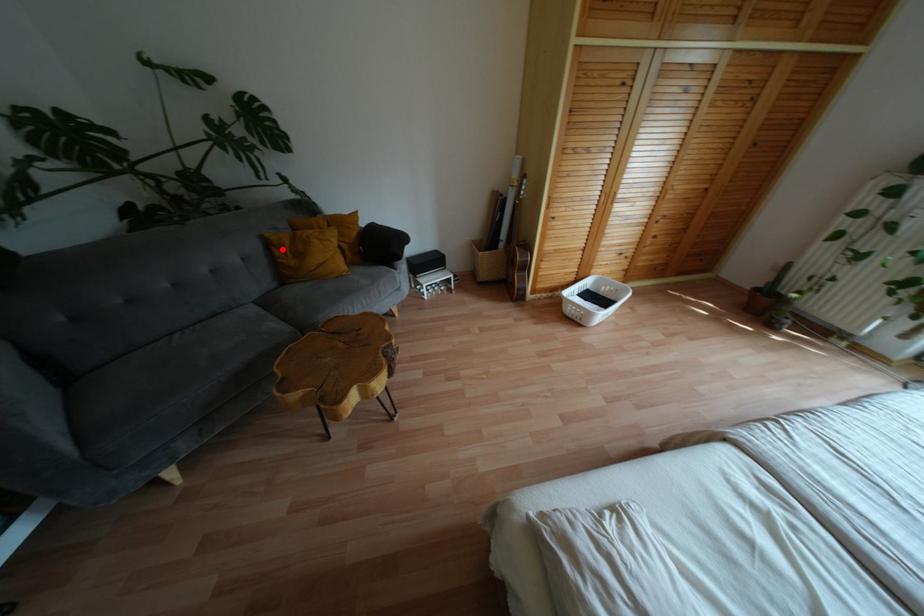
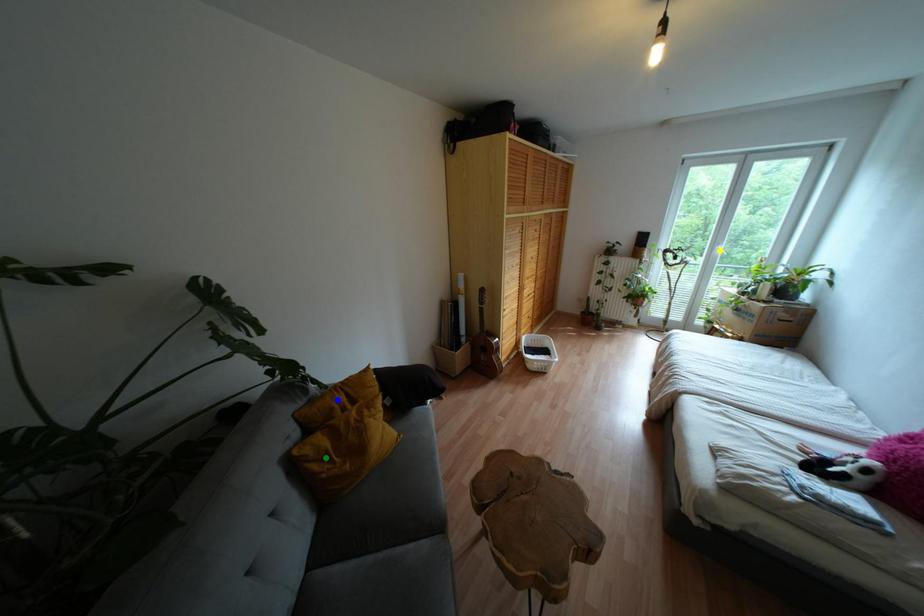
Question: I am providing you with two images of the same scene from different viewpoints. A red point is marked on the first image. You are given multiple points on the second image. Which point in image 2 represents the same 3d spot as the red point in image 1?

Choices:
 (A) yellow point
 (B) blue point
 (C) green point

Answer: (C)